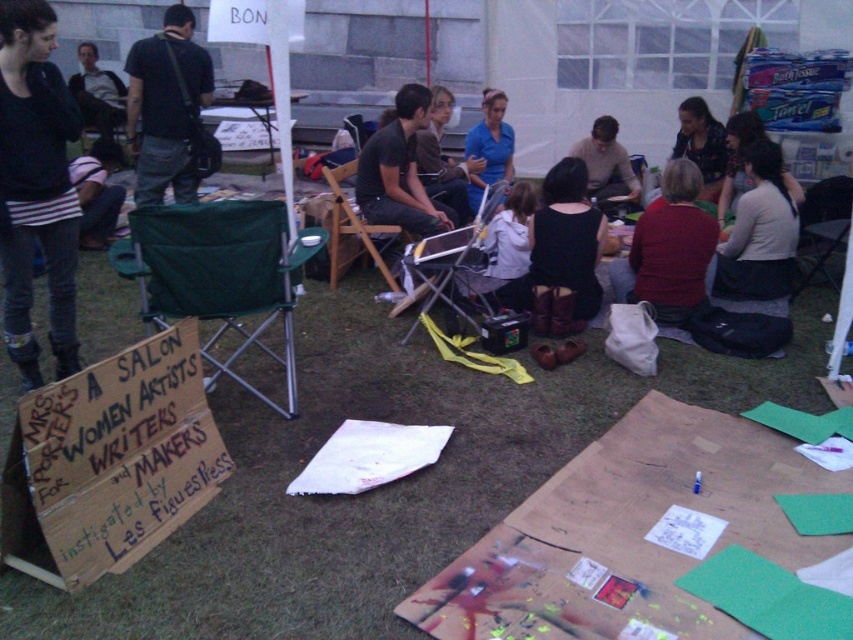
Question: Can you confirm if dark gray t-shirt at center is smaller than wooden folding chair at center?

Choices:
 (A) yes
 (B) no

Answer: (A)

Question: Among these points, which one is nearest to the camera?

Choices:
 (A) (18, 252)
 (B) (440, 227)

Answer: (A)

Question: Which object is the closest to the dark brown hair at upper right?

Choices:
 (A) wooden folding chair at center
 (B) green fabric folding chair at lower left

Answer: (A)

Question: Which object is the farthest from the light brown sweater at center?

Choices:
 (A) blue shirt at center
 (B) wooden folding chair at center

Answer: (B)

Question: Can you confirm if pink striped shirt at lower left is smaller than blue shirt at center?

Choices:
 (A) yes
 (B) no

Answer: (A)

Question: Does light beige sweater at center come behind pink striped shirt at lower left?

Choices:
 (A) yes
 (B) no

Answer: (B)